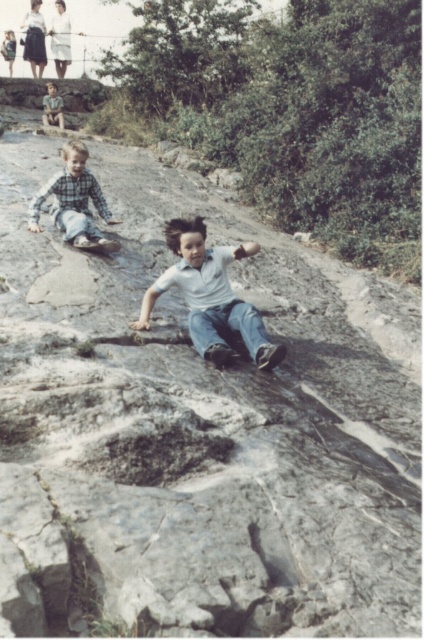
Which is below, white matte shirt at center or checkered fabric shirt at left?

Positioned lower is white matte shirt at center.

Based on the photo, measure the distance between white matte shirt at center and camera.

The distance of white matte shirt at center from camera is 14.73 feet.

Locate an element on the screen. The width and height of the screenshot is (424, 640). white matte shirt at center is located at coordinates (209, 296).

Can you confirm if white matte shirt at center is smaller than light brown hair at upper left?

Yes, white matte shirt at center is smaller than light brown hair at upper left.

You are a GUI agent. You are given a task and a screenshot of the screen. Output one action in this format:
    pyautogui.click(x=<x>, y=<y>)
    Task: Click on the white matte shirt at center
    The height and width of the screenshot is (640, 424).
    Given the screenshot: What is the action you would take?
    pyautogui.click(x=209, y=296)

Is point (203, 337) positioned after point (44, 97)?

No.

Where is `white matte shirt at center`? This screenshot has height=640, width=424. white matte shirt at center is located at coordinates (209, 296).

Between checkered fabric shirt at left and light brown hair at upper left, which one has less height?

checkered fabric shirt at left is shorter.

Can you confirm if checkered fabric shirt at left is thinner than light brown hair at upper left?

Incorrect, checkered fabric shirt at left's width is not less than light brown hair at upper left's.

Between point (89, 244) and point (53, 93), which one is positioned behind?

The point (53, 93) is behind.

Image resolution: width=424 pixels, height=640 pixels. Find the location of `checkered fabric shirt at left`. checkered fabric shirt at left is located at coordinates (75, 202).